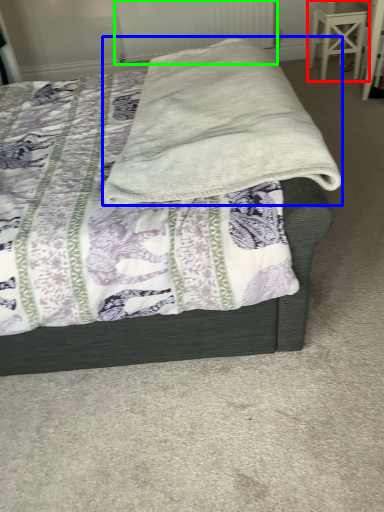
Question: Estimate the real-world distances between objects in this image. Which object is closer to stool (highlighted by a red box), blanket (highlighted by a blue box) or radiator (highlighted by a green box)?

Choices:
 (A) blanket
 (B) radiator

Answer: (B)